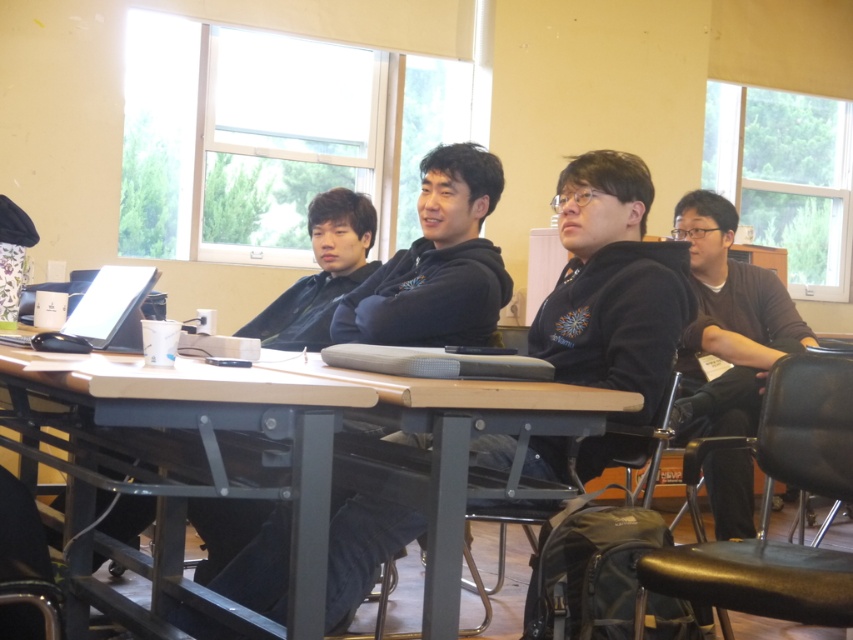
Is point (323, 429) farther from camera compared to point (119, 536)?

No, (323, 429) is in front of (119, 536).

Does wooden table at center have a greater height compared to matte black hoodie at center?

No, wooden table at center is not taller than matte black hoodie at center.

Is point (523, 435) positioned behind point (326, 269)?

No, it is not.

Identify the location of wooden table at center. The height and width of the screenshot is (640, 853). (331, 442).

Is dark brown sweater at right thinner than matte black laptop at left?

Incorrect, dark brown sweater at right's width is not less than matte black laptop at left's.

Between dark brown sweater at right and matte black laptop at left, which one is positioned lower?

Positioned lower is dark brown sweater at right.

Is point (790, 324) positioned after point (96, 326)?

Yes, it is.

I want to click on dark brown sweater at right, so click(x=730, y=316).

Does wooden table at center have a smaller size compared to dark brown sweater at right?

Incorrect, wooden table at center is not smaller in size than dark brown sweater at right.

Who is positioned more to the left, wooden table at center or dark brown sweater at right?

From the viewer's perspective, wooden table at center appears more on the left side.

Between point (425, 417) and point (722, 358), which one is positioned behind?

Positioned behind is point (722, 358).

Locate an element on the screen. wooden table at center is located at coordinates (331, 442).